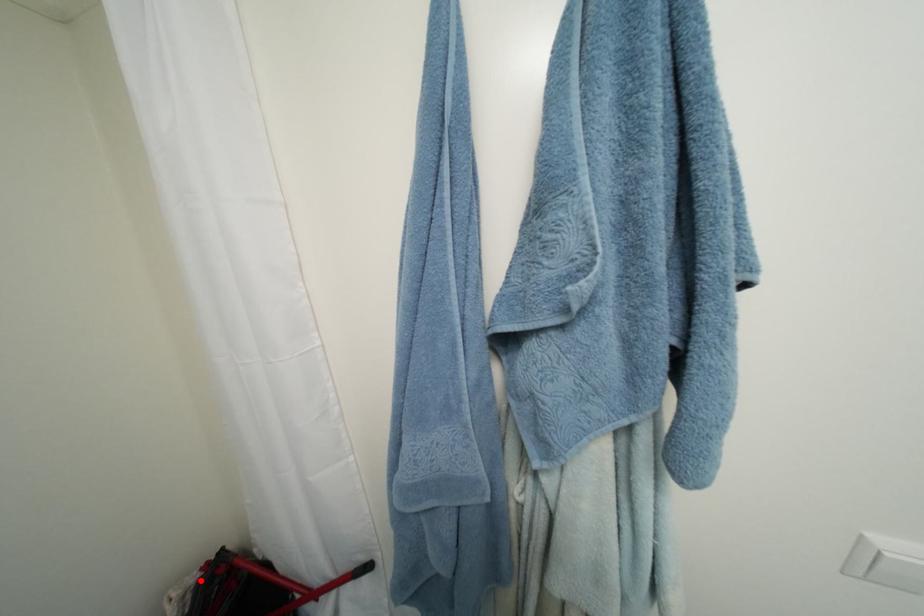
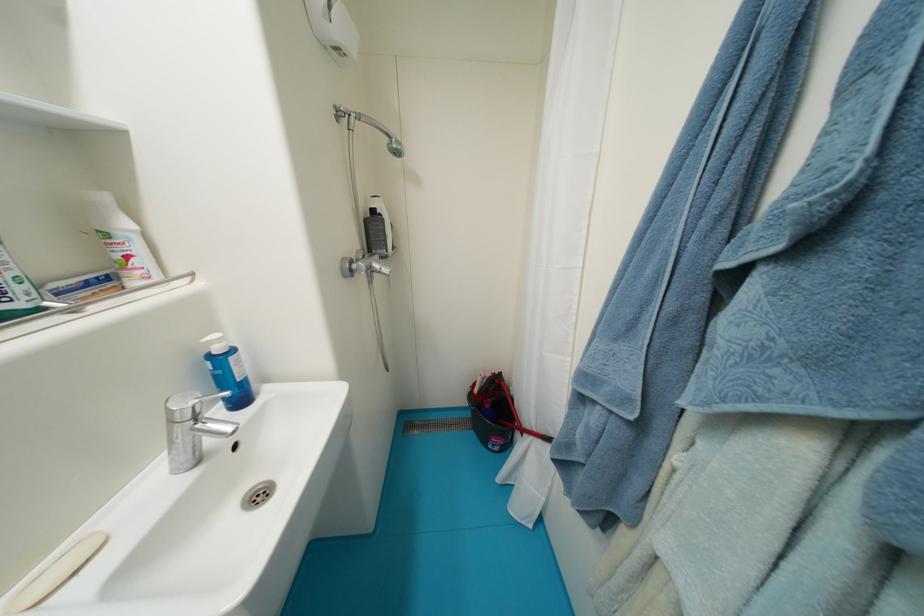
Question: I am providing you with two images of the same scene from different viewpoints. In image1, a red point is highlighted. Considering the same 3D point in image2, which of the following is correct?

Choices:
 (A) It is closer
 (B) It is farther

Answer: (B)